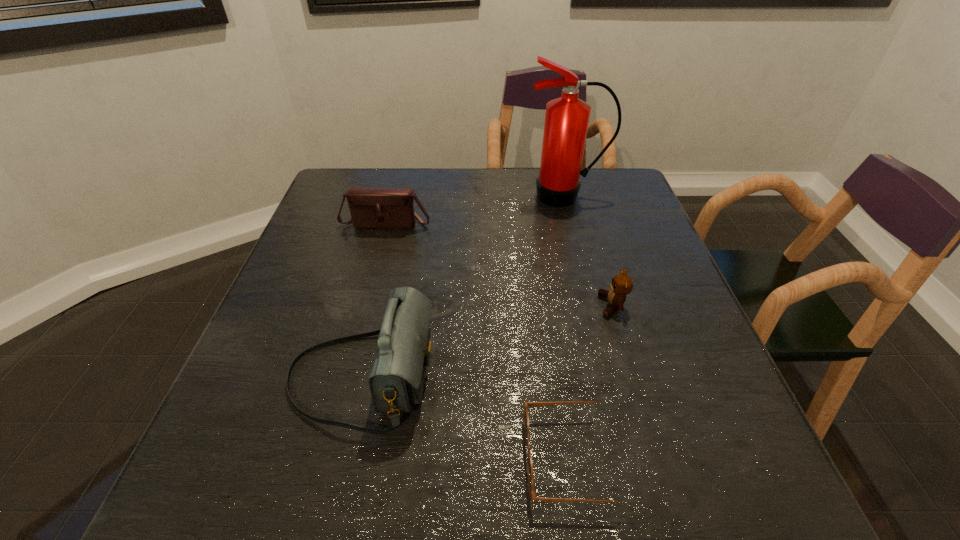
Where is `fire extinguisher at the right edge`? The height and width of the screenshot is (540, 960). fire extinguisher at the right edge is located at coordinates (566, 123).

You are a GUI agent. You are given a task and a screenshot of the screen. Output one action in this format:
    pyautogui.click(x=<x>, y=<y>)
    Task: Click on the teddy bear positioned at the right edge
    
    Given the screenshot: What is the action you would take?
    pyautogui.click(x=621, y=285)

What are the coordinates of `object that is at the far right corner` in the screenshot? It's located at (566, 123).

Image resolution: width=960 pixels, height=540 pixels. I want to click on vacant point at the far edge, so click(x=395, y=184).

Where is `free space at the near edge`? The width and height of the screenshot is (960, 540). free space at the near edge is located at coordinates (407, 507).

You are a GUI agent. You are given a task and a screenshot of the screen. Output one action in this format:
    pyautogui.click(x=<x>, y=<y>)
    Task: Click on the free spot at the left edge of the desktop
    The image size is (960, 540).
    Given the screenshot: What is the action you would take?
    pyautogui.click(x=334, y=247)

Image resolution: width=960 pixels, height=540 pixels. Identify the location of free location at the right edge of the desktop. (682, 423).

Identify the location of vacant space at the far left corner. This screenshot has height=540, width=960. (334, 172).

Locate an element on the screen. free point at the near left corner is located at coordinates click(x=188, y=503).

The image size is (960, 540). I want to click on free region at the far right corner, so click(x=594, y=179).